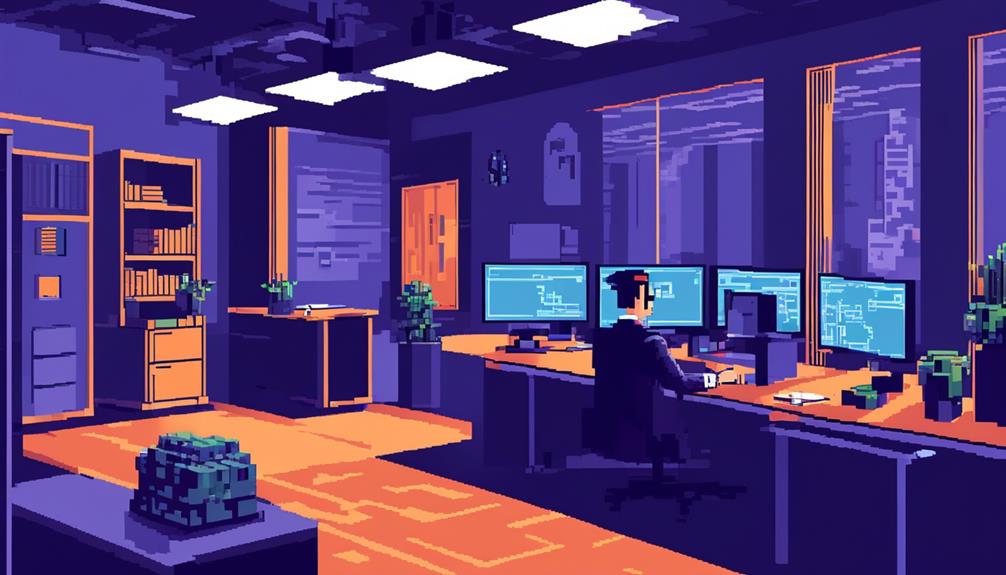
This screenshot has height=575, width=1006. Identify the location of desk. (876, 423), (574, 369).